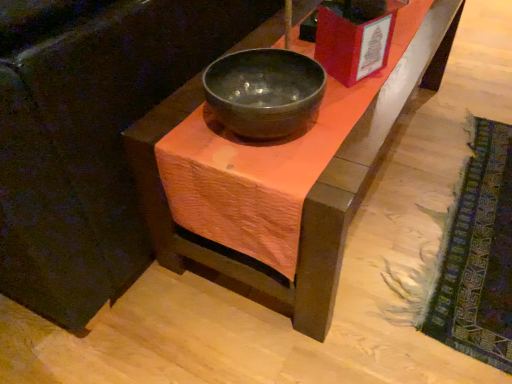
Question: Could you tell me if textured woolen mat at lower right is turned towards matte black bowl at center?

Choices:
 (A) no
 (B) yes

Answer: (A)

Question: Is textured woolen mat at lower right smaller than matte black bowl at center?

Choices:
 (A) no
 (B) yes

Answer: (A)

Question: From the image's perspective, is textured woolen mat at lower right located beneath matte black bowl at center?

Choices:
 (A) no
 (B) yes

Answer: (B)

Question: Can you confirm if textured woolen mat at lower right is positioned to the left of matte black bowl at center?

Choices:
 (A) no
 (B) yes

Answer: (A)

Question: From a real-world perspective, is textured woolen mat at lower right positioned under matte black bowl at center based on gravity?

Choices:
 (A) yes
 (B) no

Answer: (A)

Question: Is textured woolen mat at lower right closer to the viewer compared to matte black bowl at center?

Choices:
 (A) yes
 (B) no

Answer: (B)

Question: Is matte black bowl at center wider than matte black bowl at center?

Choices:
 (A) yes
 (B) no

Answer: (B)

Question: From the image's perspective, is matte black bowl at center beneath matte black bowl at center?

Choices:
 (A) no
 (B) yes

Answer: (B)

Question: From a real-world perspective, is matte black bowl at center under matte black bowl at center?

Choices:
 (A) yes
 (B) no

Answer: (B)

Question: From the image's perspective, is matte black bowl at center above matte black bowl at center?

Choices:
 (A) no
 (B) yes

Answer: (A)

Question: Is matte black bowl at center taller than matte black bowl at center?

Choices:
 (A) yes
 (B) no

Answer: (B)

Question: From a real-world perspective, is matte black bowl at center located higher than matte black bowl at center?

Choices:
 (A) no
 (B) yes

Answer: (B)

Question: Is textured woolen mat at lower right at the right side of matte black bowl at center?

Choices:
 (A) yes
 (B) no

Answer: (A)